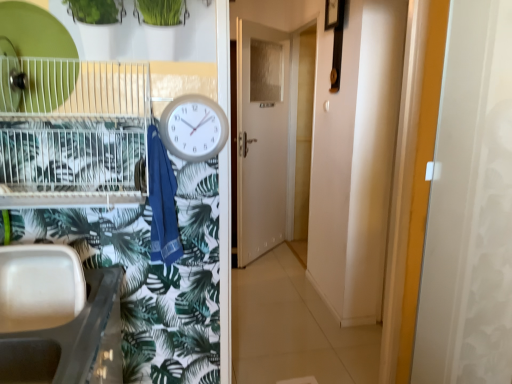
Measure the distance between point (108, 357) and camera.

1.31 meters.

The height and width of the screenshot is (384, 512). What do you see at coordinates (261, 138) in the screenshot?
I see `white glossy door at center` at bounding box center [261, 138].

Locate an element on the screen. white plastic sink at lower left is located at coordinates (57, 317).

In terms of size, does blue cotton towel at center appear bigger or smaller than white glossy screen door at right?

Clearly, blue cotton towel at center is smaller in size than white glossy screen door at right.

In the scene shown: Is blue cotton towel at center facing towards white glossy screen door at right?

No, blue cotton towel at center is not turned towards white glossy screen door at right.

Is blue cotton towel at center completely or partially outside of white glossy screen door at right?

Yes.

Is blue cotton towel at center directly adjacent to white glossy screen door at right?

No, blue cotton towel at center is not next to white glossy screen door at right.

Is blue cotton towel at center far from white plastic sink at lower left?

No, there isn't a large distance between blue cotton towel at center and white plastic sink at lower left.

Which of these two, blue cotton towel at center or white plastic sink at lower left, is wider?

With larger width is white plastic sink at lower left.

Does blue cotton towel at center come in front of white plastic sink at lower left?

No.

Is blue cotton towel at center at the left side of white plastic sink at lower left?

No.

Considering the relative sizes of white glossy door at center and white glossy screen door at right in the image provided, is white glossy door at center wider than white glossy screen door at right?

No, white glossy door at center is not wider than white glossy screen door at right.

Which of these two, white glossy door at center or white glossy screen door at right, is bigger?

Bigger between the two is white glossy door at center.

How many degrees apart are the facing directions of white glossy door at center and white glossy screen door at right?

They differ by 41.7 degrees in their facing directions.

Considering the relative sizes of white plastic clock at center and white glossy screen door at right in the image provided, is white plastic clock at center bigger than white glossy screen door at right?

No.

Considering the sizes of objects white plastic clock at center and white glossy screen door at right in the image provided, who is thinner, white plastic clock at center or white glossy screen door at right?

white plastic clock at center.

Is white plastic clock at center further to camera compared to white glossy screen door at right?

Yes, white plastic clock at center is further from the viewer.

Locate an element on the screen. This screenshot has height=384, width=512. clock above the white glossy screen door at right (from the image's perspective) is located at coordinates (194, 128).

Between white glossy door at center and metallic wire birdcage at left, which one appears on the right side from the viewer's perspective?

white glossy door at center is more to the right.

From the image's perspective, is white glossy door at center above metallic wire birdcage at left?

Yes, from the image's perspective, white glossy door at center is above metallic wire birdcage at left.

Is metallic wire birdcage at left inside white glossy door at center?

That's incorrect, metallic wire birdcage at left is not inside white glossy door at center.

From a real-world perspective, is white glossy door at center physically above metallic wire birdcage at left?

No.

Considering the points (62, 130) and (272, 90), which point is behind, point (62, 130) or point (272, 90)?

The point (272, 90) is more distant.

Who is more distant, metallic wire birdcage at left or white glossy door at center?

white glossy door at center is further away from the camera.

Locate an element on the screen. bird cage that appears below the white glossy door at center (from the image's perspective) is located at coordinates (73, 133).

In terms of width, does metallic wire birdcage at left look wider or thinner when compared to white glossy door at center?

Clearly, metallic wire birdcage at left has more width compared to white glossy door at center.

Is white glossy door at center at the back of white plastic clock at center?

Yes.

Which of these two, white plastic clock at center or white glossy door at center, stands taller?

Standing taller between the two is white glossy door at center.

Is white plastic clock at center inside or outside of white glossy door at center?

The correct answer is: outside.

Locate an element on the screen. The width and height of the screenshot is (512, 384). screen door that is below the blue cotton towel at center (from the image's perspective) is located at coordinates (470, 207).

What are the coordinates of `laundry that appears on the right of white plastic sink at lower left` in the screenshot? It's located at (162, 202).

From the image, which object appears to be farther from white glossy door at center, white plastic sink at lower left or white glossy screen door at right?

white glossy screen door at right is positioned further to the anchor white glossy door at center.

Based on their spatial positions, is metallic wire birdcage at left or white plastic clock at center further from white glossy door at center?

Among the two, white plastic clock at center is located further to white glossy door at center.

Based on their spatial positions, is metallic wire birdcage at left or blue cotton towel at center further from white plastic sink at lower left?

Among the two, metallic wire birdcage at left is located further to white plastic sink at lower left.

Which object lies nearer to the anchor point metallic wire birdcage at left, white glossy screen door at right or white plastic sink at lower left?

white plastic sink at lower left is positioned closer to the anchor metallic wire birdcage at left.

Estimate the real-world distances between objects in this image. Which object is further from white glossy screen door at right, blue cotton towel at center or white glossy door at center?

The object further to white glossy screen door at right is white glossy door at center.

Estimate the real-world distances between objects in this image. Which object is further from white plastic clock at center, metallic wire birdcage at left or white glossy screen door at right?

white glossy screen door at right is positioned further to the anchor white plastic clock at center.

When comparing their distances from white plastic clock at center, does white glossy screen door at right or metallic wire birdcage at left seem further?

white glossy screen door at right is further to white plastic clock at center.

From the image, which object appears to be farther from white glossy door at center, white glossy screen door at right or white plastic sink at lower left?

Based on the image, white glossy screen door at right appears to be further to white glossy door at center.

This screenshot has height=384, width=512. I want to click on clock situated between blue cotton towel at center and white glossy screen door at right from left to right, so click(194, 128).

You are a GUI agent. You are given a task and a screenshot of the screen. Output one action in this format:
    pyautogui.click(x=<x>, y=<y>)
    Task: Click on the clock situated between metallic wire birdcage at left and white glossy screen door at right from left to right
    The height and width of the screenshot is (384, 512).
    Given the screenshot: What is the action you would take?
    pyautogui.click(x=194, y=128)

What are the coordinates of `bird cage between white plastic sink at lower left and white glossy door at center along the z-axis` in the screenshot? It's located at [x=73, y=133].

At what (x,y) coordinates should I click in order to perform the action: click on bird cage between white plastic clock at center and white plastic sink at lower left from top to bottom. Please return your answer as a coordinate pair (x, y). The width and height of the screenshot is (512, 384). Looking at the image, I should click on (73, 133).